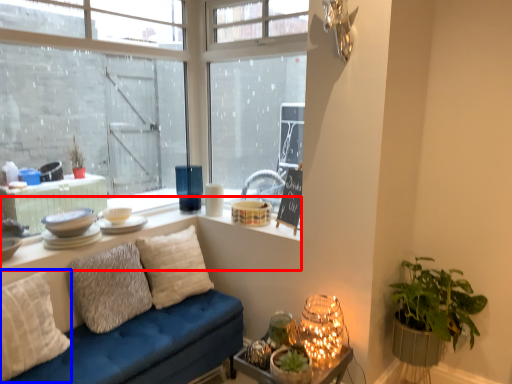
Question: Which of the following is the closest to the observer, window (highlighted by a red box) or pillow (highlighted by a blue box)?

Choices:
 (A) window
 (B) pillow

Answer: (B)